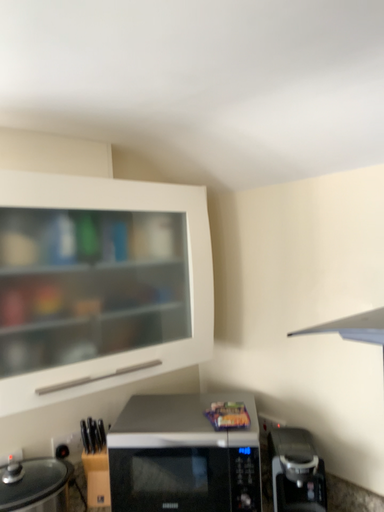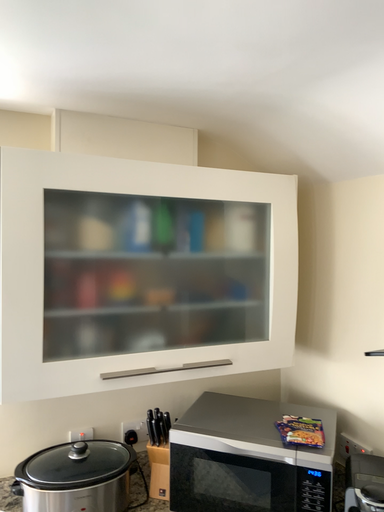
Question: How did the camera likely rotate when shooting the video?

Choices:
 (A) rotated right
 (B) rotated left

Answer: (B)